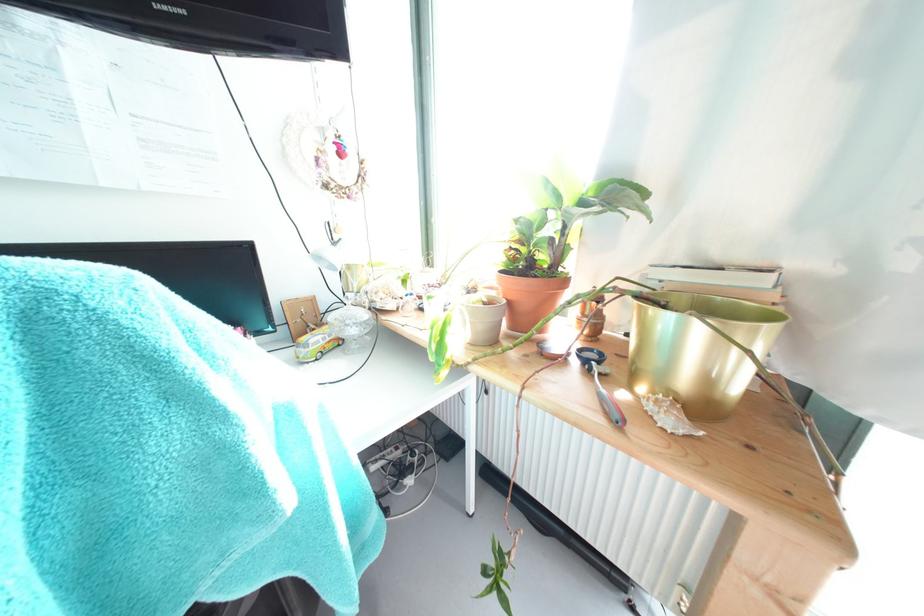
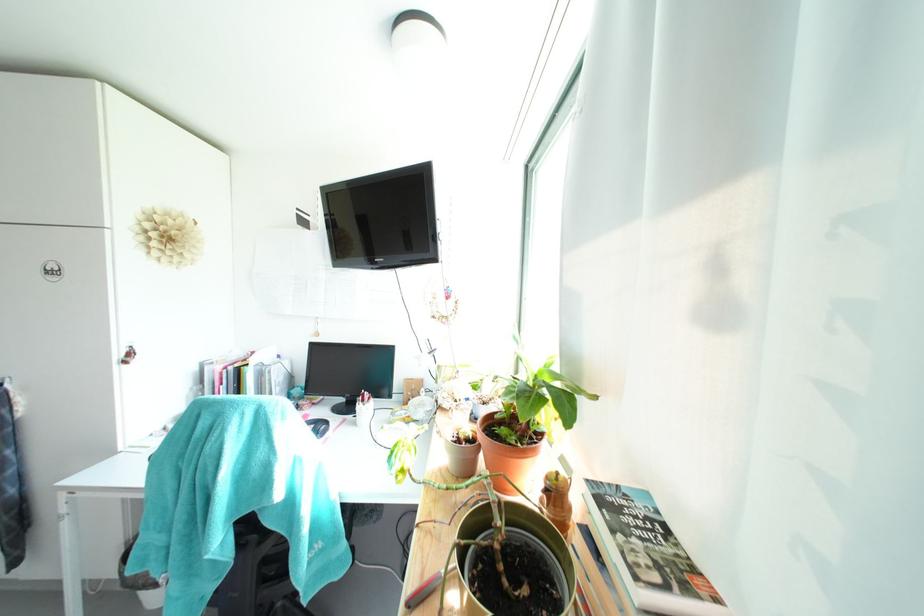
Question: The camera is either moving clockwise (left) or counter-clockwise (right) around the object. The first image is from the beginning of the video and the second image is from the end. Is the camera moving left or right when shooting the video?

Choices:
 (A) Left
 (B) Right

Answer: (B)